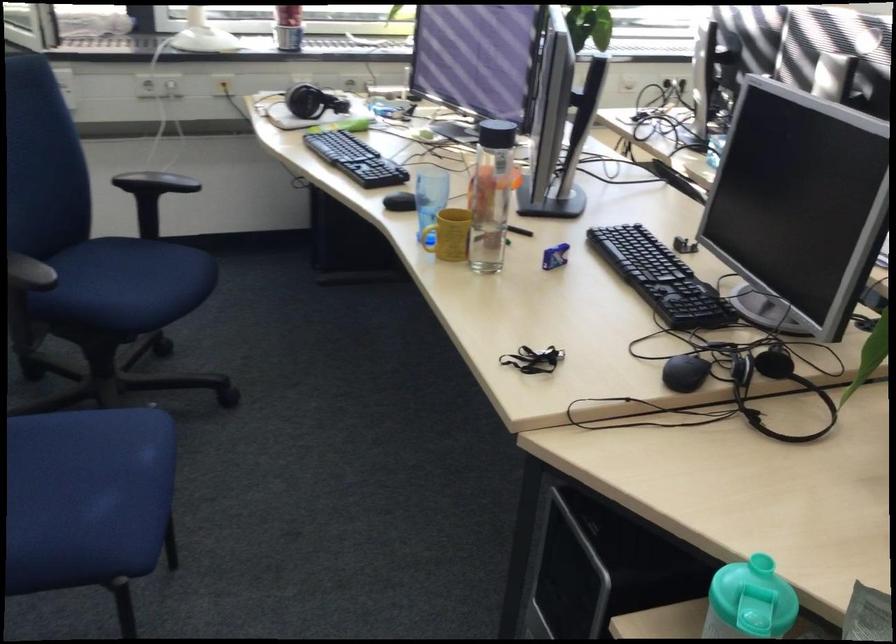
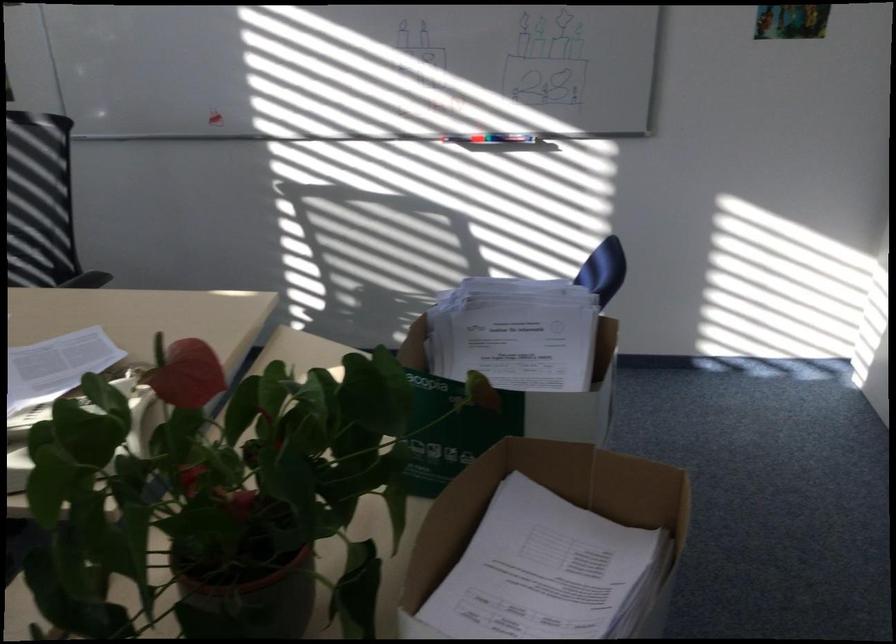
Question: The camera is either moving clockwise (left) or counter-clockwise (right) around the object. The first image is from the beginning of the video and the second image is from the end. Is the camera moving left or right when shooting the video?

Choices:
 (A) Left
 (B) Right

Answer: (A)